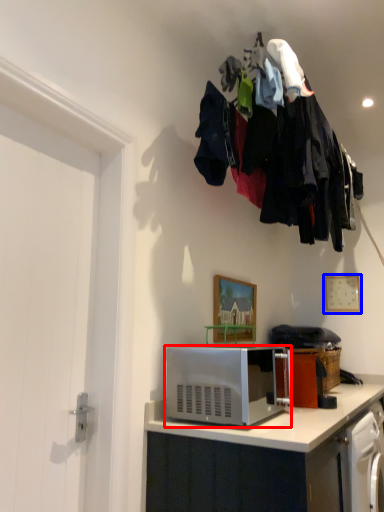
Question: Which object appears farthest to the camera in this image, microwave oven (highlighted by a red box) or picture frame (highlighted by a blue box)?

Choices:
 (A) microwave oven
 (B) picture frame

Answer: (B)